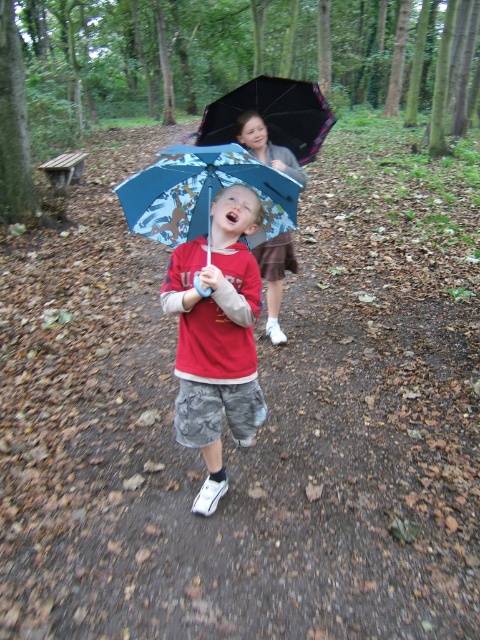
Question: Is camouflage shorts at center further to the viewer compared to matte blue umbrella at center?

Choices:
 (A) yes
 (B) no

Answer: (B)

Question: Does blue fabric umbrella at center lie in front of black matte umbrella at upper center?

Choices:
 (A) no
 (B) yes

Answer: (B)

Question: Which point is farther to the camera?

Choices:
 (A) blue fabric umbrella at center
 (B) black matte umbrella at upper center
 (C) camouflage shorts at center
 (D) matte blue umbrella at center

Answer: (B)

Question: Is the position of camouflage shorts at center more distant than that of blue fabric umbrella at center?

Choices:
 (A) yes
 (B) no

Answer: (A)

Question: Which of the following is the closest to the observer?

Choices:
 (A) coord(289,124)
 (B) coord(285,216)

Answer: (B)

Question: Which point is closer to the camera?

Choices:
 (A) camouflage shorts at center
 (B) blue fabric umbrella at center
 (C) black matte umbrella at upper center

Answer: (B)